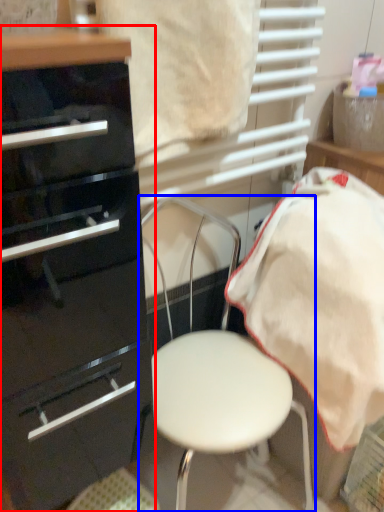
Question: Which point is closer to the camera, chest of drawers (highlighted by a red box) or chair (highlighted by a blue box)?

Choices:
 (A) chest of drawers
 (B) chair

Answer: (A)